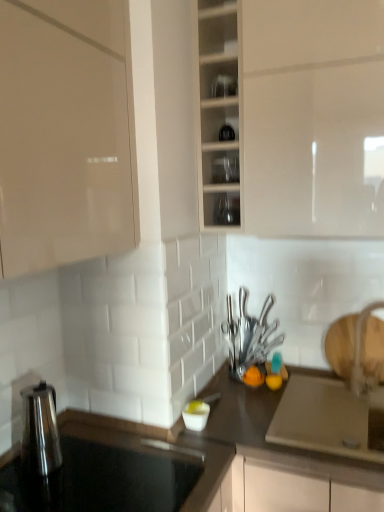
Question: Can we say white glossy faucet at right lies outside white glossy bowl at center, acting as the first tableware starting from the left?

Choices:
 (A) yes
 (B) no

Answer: (A)

Question: Can you confirm if white glossy faucet at right is smaller than white glossy bowl at center, the 3th tableware positioned from the top?

Choices:
 (A) no
 (B) yes

Answer: (A)

Question: Is white glossy faucet at right taller than white glossy bowl at center, the third tableware from the right?

Choices:
 (A) no
 (B) yes

Answer: (B)

Question: From the image's perspective, is white glossy faucet at right under white glossy bowl at center, the 3th tableware positioned from the top?

Choices:
 (A) no
 (B) yes

Answer: (A)

Question: From a real-world perspective, is white glossy faucet at right on white glossy bowl at center, acting as the first tableware starting from the left?

Choices:
 (A) yes
 (B) no

Answer: (A)

Question: Can you confirm if white glossy faucet at right is shorter than white glossy bowl at center, the third tableware from the right?

Choices:
 (A) no
 (B) yes

Answer: (A)

Question: Considering the relative sizes of clear glass cups at center, arranged as the second tableware when viewed from the back, and black glossy countertop at lower left, acting as the first countertop starting from the top, in the image provided, is clear glass cups at center, arranged as the second tableware when viewed from the back, thinner than black glossy countertop at lower left, acting as the first countertop starting from the top,?

Choices:
 (A) no
 (B) yes

Answer: (B)

Question: Considering the relative sizes of clear glass cups at center, the 1th tableware when ordered from top to bottom, and black glossy countertop at lower left, placed as the 1th countertop when sorted from left to right, in the image provided, is clear glass cups at center, the 1th tableware when ordered from top to bottom, wider than black glossy countertop at lower left, placed as the 1th countertop when sorted from left to right,?

Choices:
 (A) no
 (B) yes

Answer: (A)

Question: Does clear glass cups at center, which is counted as the 2th tableware, starting from the left, have a smaller size compared to black glossy countertop at lower left, placed as the 1th countertop when sorted from left to right?

Choices:
 (A) no
 (B) yes

Answer: (B)

Question: From a real-world perspective, is clear glass cups at center, arranged as the second tableware when viewed from the back, physically below black glossy countertop at lower left, arranged as the second countertop when ordered from the bottom?

Choices:
 (A) no
 (B) yes

Answer: (A)

Question: Could you tell me if clear glass cups at center, the 1th tableware when ordered from top to bottom, is facing black glossy countertop at lower left, acting as the first countertop starting from the top?

Choices:
 (A) no
 (B) yes

Answer: (A)

Question: Is clear glass cups at center, marked as the second tableware in a front-to-back arrangement, shorter than black glossy countertop at lower left, acting as the first countertop starting from the top?

Choices:
 (A) yes
 (B) no

Answer: (B)

Question: From the image's perspective, is white glossy bowl at center, the first tableware in the front-to-back sequence, above transparent glass jars at upper center, the 2th shelf when ordered from bottom to top?

Choices:
 (A) no
 (B) yes

Answer: (A)